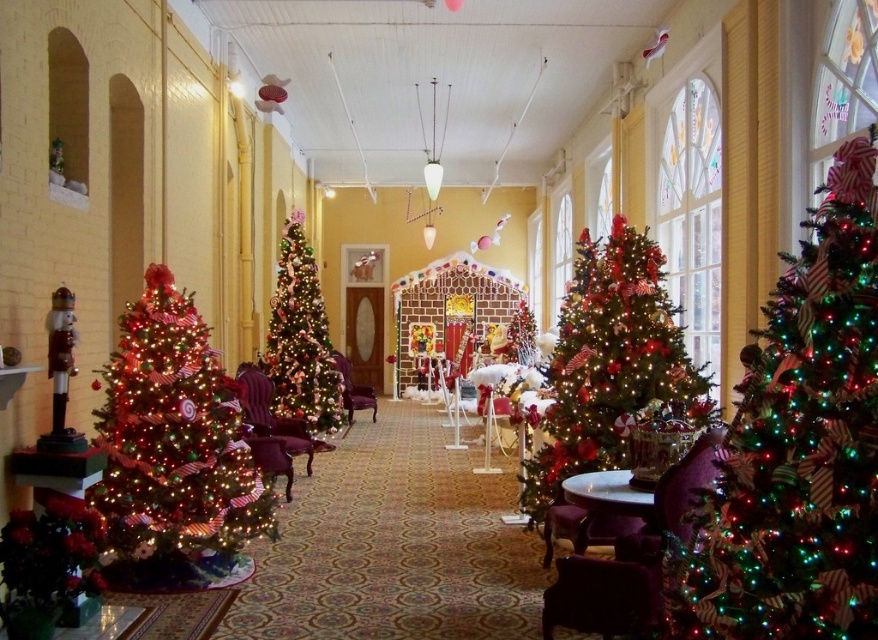
Is purple velvet armchair at lower right taller than velvet purple armchair at center?

In fact, purple velvet armchair at lower right may be shorter than velvet purple armchair at center.

Is purple velvet armchair at lower right positioned before velvet purple armchair at center?

Yes.

Is point (678, 460) positioned after point (346, 365)?

No, it is in front of (346, 365).

Image resolution: width=878 pixels, height=640 pixels. Identify the location of purple velvet armchair at lower right. (632, 560).

Does shiny green christmas tree at right have a larger size compared to shiny green christmas tree at center?

Actually, shiny green christmas tree at right might be smaller than shiny green christmas tree at center.

Between point (803, 365) and point (317, 344), which one is positioned behind?

The point (317, 344) is behind.

Locate an element on the screen. This screenshot has width=878, height=640. shiny green christmas tree at right is located at coordinates (797, 445).

Is shiny green christmas tree at right positioned at the back of green shiny christmas tree at center?

No, shiny green christmas tree at right is in front of green shiny christmas tree at center.

Between shiny green christmas tree at right and green shiny christmas tree at center, which one appears on the left side from the viewer's perspective?

Positioned to the left is shiny green christmas tree at right.

Image resolution: width=878 pixels, height=640 pixels. In order to click on shiny green christmas tree at right in this screenshot , I will do `click(797, 445)`.